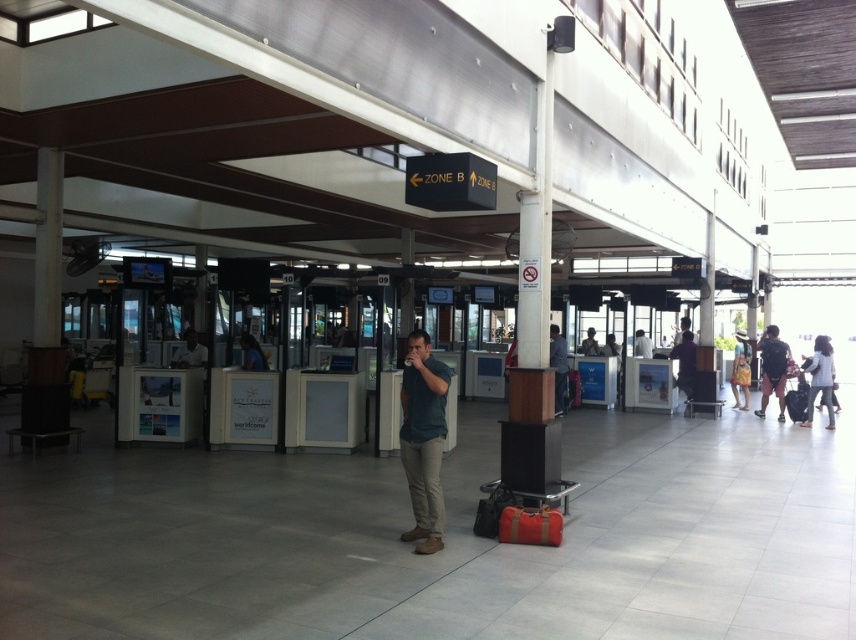
Is dark blue jeans at right above matte black suitcase at center?

Indeed, dark blue jeans at right is positioned over matte black suitcase at center.

Who is more forward, (774, 348) or (800, 385)?

Point (800, 385)

The width and height of the screenshot is (856, 640). Find the location of `dark blue jeans at right`. dark blue jeans at right is located at coordinates (773, 369).

Is blue fabric shirt at center taller than dark blue shirt at center?

No.

Measure the distance from blue fabric shirt at center to dark blue shirt at center.

blue fabric shirt at center is 13.82 meters away from dark blue shirt at center.

Who is more distant from viewer, (259, 365) or (675, 342)?

The point (675, 342) is more distant.

Find the location of a particular element. blue fabric shirt at center is located at coordinates (253, 353).

Between white fabric shirt at center and light brown leather jacket at center, which one appears on the left side from the viewer's perspective?

light brown leather jacket at center

What do you see at coordinates (642, 344) in the screenshot? This screenshot has height=640, width=856. I see `white fabric shirt at center` at bounding box center [642, 344].

At what (x,y) coordinates should I click in order to perform the action: click on white fabric shirt at center. Please return your answer as a coordinate pair (x, y). Looking at the image, I should click on (642, 344).